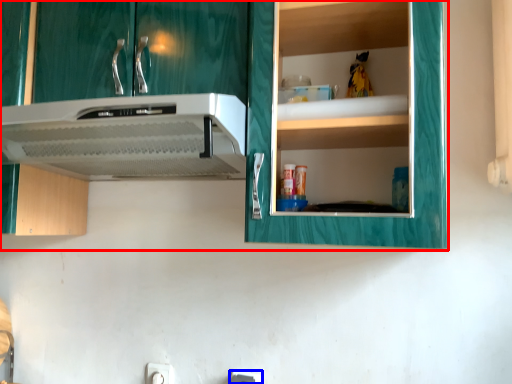
Question: Which point is closer to the camera, cabinetry (highlighted by a red box) or electric outlet (highlighted by a blue box)?

Choices:
 (A) cabinetry
 (B) electric outlet

Answer: (A)